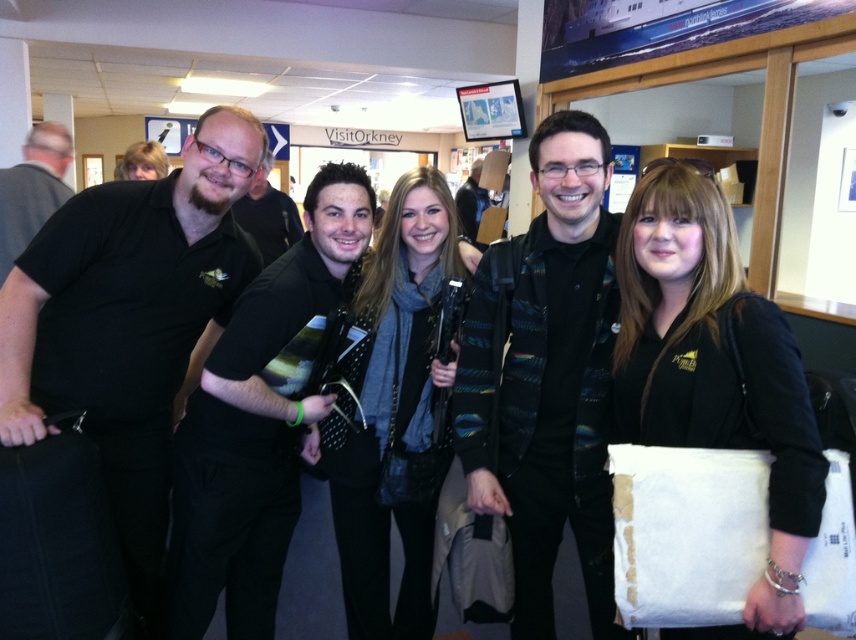
Question: Considering the relative positions of black matte shirt at left and patterned sweater at center in the image provided, where is black matte shirt at left located with respect to patterned sweater at center?

Choices:
 (A) above
 (B) below

Answer: (A)

Question: Which object is closer to the camera taking this photo?

Choices:
 (A) black matte shirt at left
 (B) patterned sweater at center

Answer: (A)

Question: Can you confirm if black matte shirt at left is thinner than patterned sweater at center?

Choices:
 (A) yes
 (B) no

Answer: (B)

Question: Which point appears closest to the camera in this image?

Choices:
 (A) (242, 184)
 (B) (581, 419)

Answer: (B)

Question: Is the position of black matte shirt at left less distant than that of patterned sweater at center?

Choices:
 (A) no
 (B) yes

Answer: (B)

Question: Which point is closer to the camera?

Choices:
 (A) (141, 497)
 (B) (590, 460)

Answer: (B)